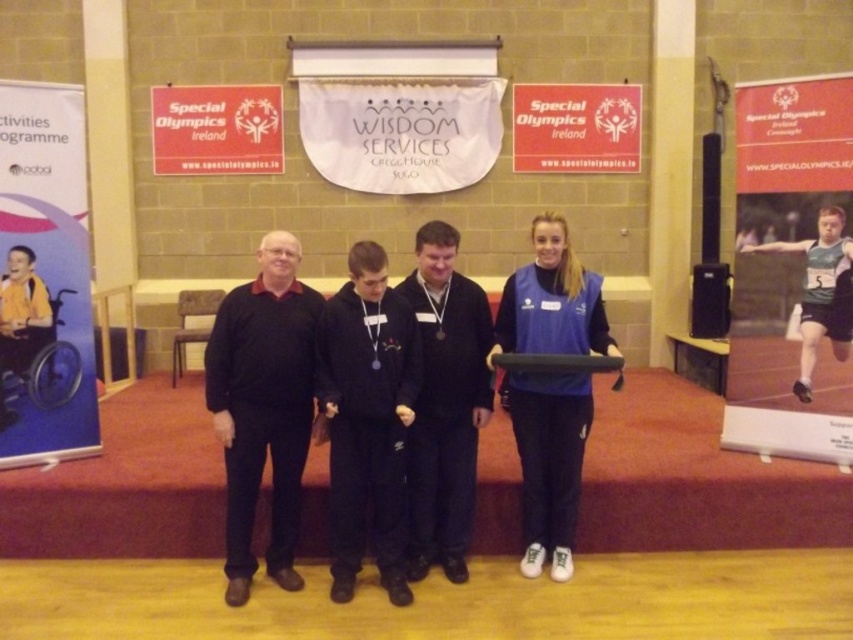
You are a photographer at the event and need to capture a photo of the two recipients holding their awards. The black fleece at center and the black matte jacket at center are both central to the image. Based on their positions, which recipient is standing to the left of the other?

The black fleece at center is to the left of the black matte jacket at center, so the recipient wearing the black fleece at center is standing to the left of the one in the black matte jacket at center.

Based on the photo, you are a photographer at the event. You need to capture a photo of the black matte sweater at center and the black matte jacket at center. The camera you are using has a minimum focus distance of 25 inches. Will you be able to focus on both objects without moving the camera?

The black matte sweater at center is 25.68 inches away from the black matte jacket at center. Since the minimum focus distance is 25 inches, the distance between them is just slightly over the required minimum. Therefore, the camera can focus on both objects without needing to move it.